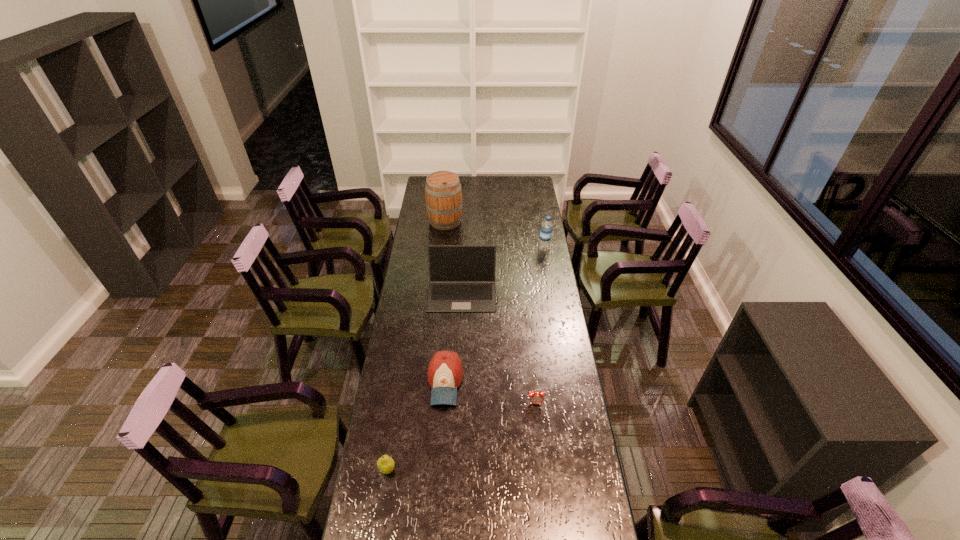
This screenshot has height=540, width=960. In order to click on alarm clock that is positioned at the right edge in this screenshot , I will do `click(536, 397)`.

The height and width of the screenshot is (540, 960). Find the location of `blank space at the far edge of the desktop`. blank space at the far edge of the desktop is located at coordinates (474, 183).

In order to click on vacant space at the left edge of the desktop in this screenshot , I will do `click(378, 501)`.

This screenshot has width=960, height=540. In the image, there is a desktop. What are the coordinates of `free space at the right edge` in the screenshot? It's located at (558, 357).

This screenshot has width=960, height=540. What are the coordinates of `free space at the far right corner of the desktop` in the screenshot? It's located at (519, 192).

Where is `unoccupied position between the fifth nearest object and the second object from right to left`? The height and width of the screenshot is (540, 960). unoccupied position between the fifth nearest object and the second object from right to left is located at coordinates (540, 326).

Locate an element on the screen. free space between the nearest object and the fourth tallest object is located at coordinates (416, 426).

You are a GUI agent. You are given a task and a screenshot of the screen. Output one action in this format:
    pyautogui.click(x=<x>, y=<y>)
    Task: Click on the empty location between the alarm clock and the fourth tallest object
    This screenshot has width=960, height=540.
    Given the screenshot: What is the action you would take?
    pyautogui.click(x=491, y=393)

Locate an element on the screen. Image resolution: width=960 pixels, height=540 pixels. unoccupied area between the fifth object from left to right and the rightmost object is located at coordinates (540, 326).

This screenshot has height=540, width=960. What are the coordinates of `vacant point located between the cider and the fifth nearest object` in the screenshot? It's located at (494, 235).